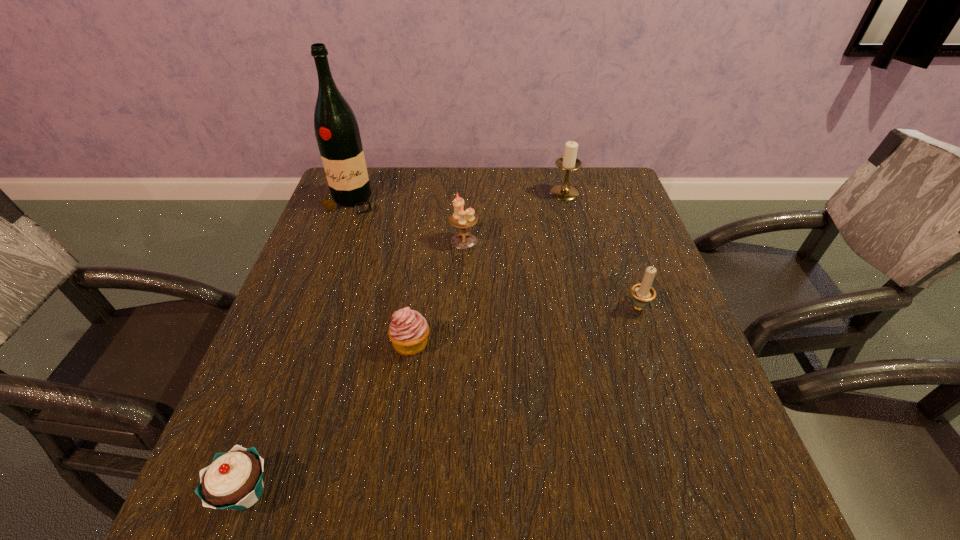
Where is `free space between the nearest object and the tallest object`? This screenshot has width=960, height=540. free space between the nearest object and the tallest object is located at coordinates (299, 348).

Locate an element on the screen. Image resolution: width=960 pixels, height=540 pixels. free space between the shortest candle_holder and the wine bottle is located at coordinates (494, 254).

In order to click on free space that is in between the farther cupcake and the tallest object in this screenshot , I will do `click(381, 273)`.

In order to click on object that is the third closest to the left cupcake in this screenshot , I will do pyautogui.click(x=337, y=133).

Select which object is the fifth closest to the left cupcake. Please provide its 2D coordinates. Your answer should be formatted as a tuple, i.e. [(x, y)], where the tuple contains the x and y coordinates of a point satisfying the conditions above.

[(568, 162)]

Locate which candle_holder ranks in proximity to the right cupcake. Please provide its 2D coordinates. Your answer should be formatted as a tuple, i.e. [(x, y)], where the tuple contains the x and y coordinates of a point satisfying the conditions above.

[(460, 218)]

What are the coordinates of `candle_holder that stands as the second closest to the wine bottle` in the screenshot? It's located at (568, 162).

The image size is (960, 540). I want to click on free point that satisfies the following two spatial constraints: 1. on the back side of the tallest object; 2. on the left side of the second object from right to left, so click(354, 193).